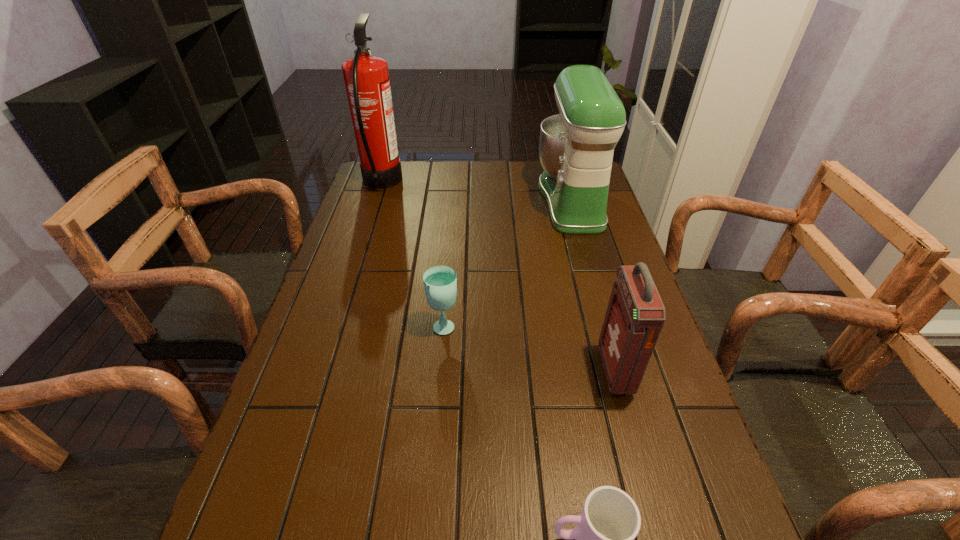
At what (x,y) coordinates should I click in order to perform the action: click on vacant area that lies between the first-aid kit and the second shortest object. Please return your answer as a coordinate pair (x, y). Looking at the image, I should click on (529, 348).

I want to click on blank region between the second nearest object and the second tallest object, so click(x=593, y=285).

Find the location of a particular element. The width and height of the screenshot is (960, 540). free area in between the leftmost object and the third farthest object is located at coordinates (413, 254).

Locate which object ranks fourth in proximity to the nearest object. Please provide its 2D coordinates. Your answer should be formatted as a tuple, i.e. [(x, y)], where the tuple contains the x and y coordinates of a point satisfying the conditions above.

[(366, 77)]

I want to click on object that is the fourth closest to the third shortest object, so click(366, 77).

The image size is (960, 540). Identify the location of vacant area that satisfies the following two spatial constraints: 1. on the front-facing side of the tallest object; 2. on the right side of the second object from left to right. (335, 325).

The height and width of the screenshot is (540, 960). What are the coordinates of `free location that satisfies the following two spatial constraints: 1. on the front-facing side of the leftmost object; 2. on the right side of the glass` in the screenshot? It's located at (335, 325).